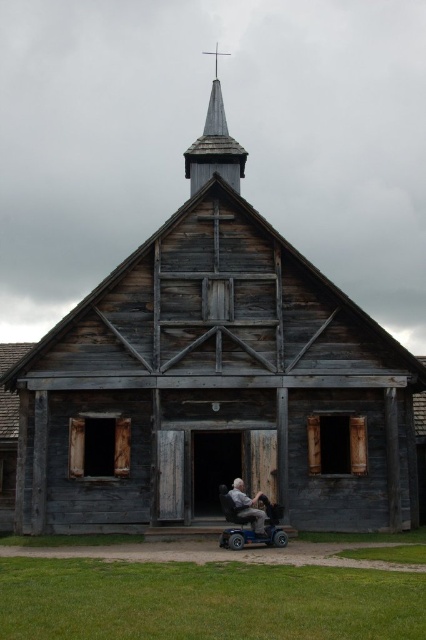
Between metallic gray scooter at center and gray plastic wheelchair at center, which one is positioned higher?

Positioned higher is gray plastic wheelchair at center.

Is metallic gray scooter at center to the right of gray plastic wheelchair at center from the viewer's perspective?

No, metallic gray scooter at center is not to the right of gray plastic wheelchair at center.

I want to click on metallic gray scooter at center, so click(x=250, y=524).

Locate an element on the screen. metallic gray scooter at center is located at coordinates (250, 524).

Looking at this image, who is lower down, wooden spire at upper center or gray plastic wheelchair at center?

gray plastic wheelchair at center is below.

Does wooden spire at upper center have a larger size compared to gray plastic wheelchair at center?

Yes, wooden spire at upper center is bigger than gray plastic wheelchair at center.

Which is behind, point (218, 161) or point (261, 513)?

Positioned behind is point (218, 161).

Where is `wooden spire at upper center`? wooden spire at upper center is located at coordinates (215, 144).

Who is positioned more to the right, wooden spire at upper center or metallic gray scooter at center?

From the viewer's perspective, metallic gray scooter at center appears more on the right side.

Who is more forward, [221,92] or [235,509]?

Point [235,509] is in front.

What are the coordinates of `wooden spire at upper center` in the screenshot? It's located at (215, 144).